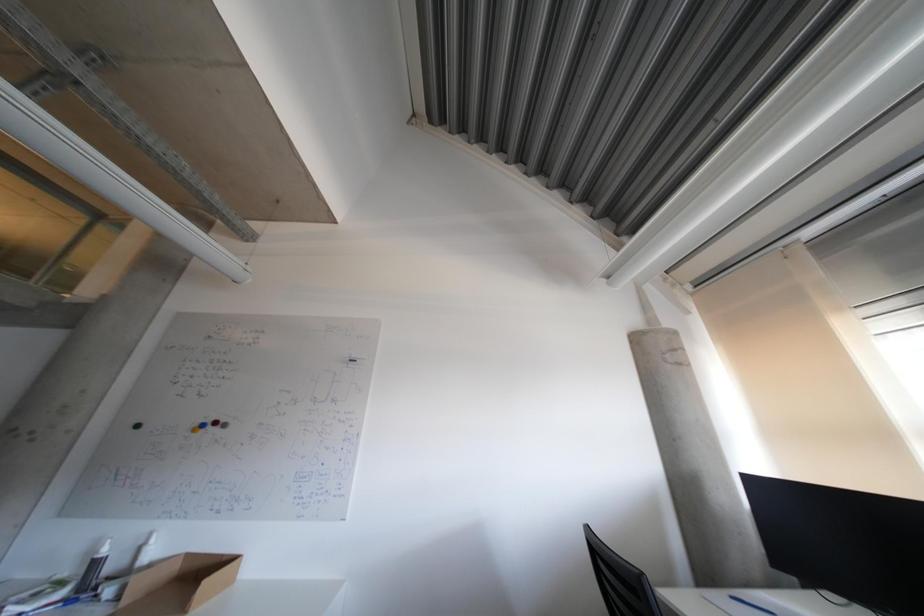
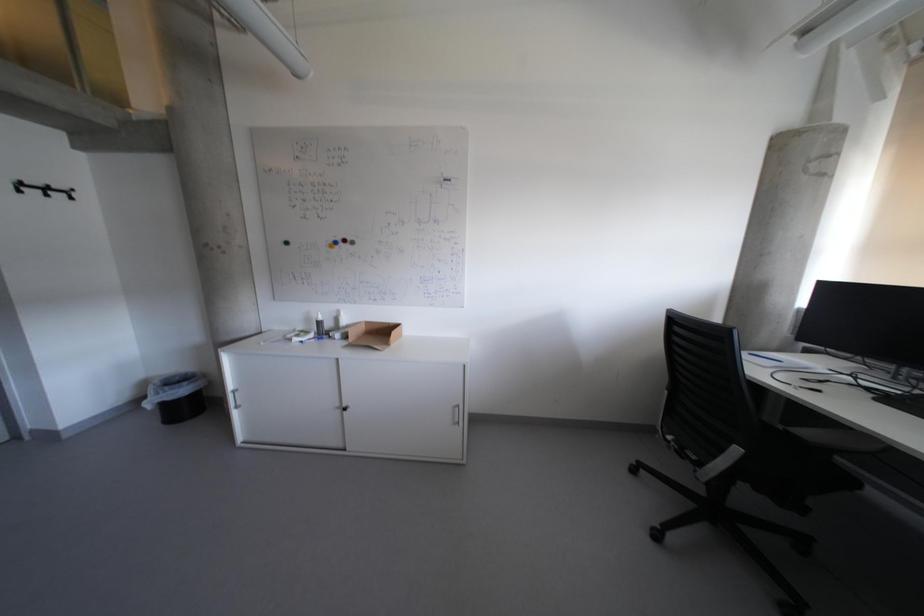
Question: The images are taken continuously from a first-person perspective. In which direction is your viewpoint rotating?

Choices:
 (A) Left
 (B) Right
 (C) Up
 (D) Down

Answer: (D)